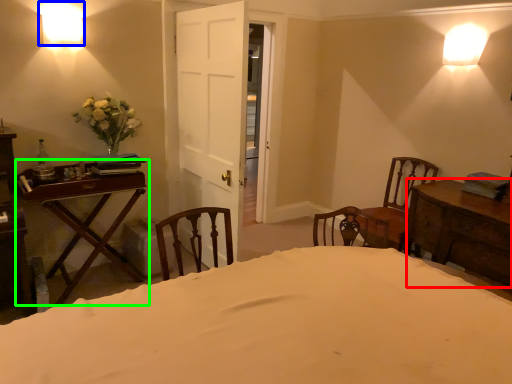
Question: Estimate the real-world distances between objects in this image. Which object is farther from table (highlighted by a red box), lamp (highlighted by a blue box) or table (highlighted by a green box)?

Choices:
 (A) lamp
 (B) table

Answer: (A)